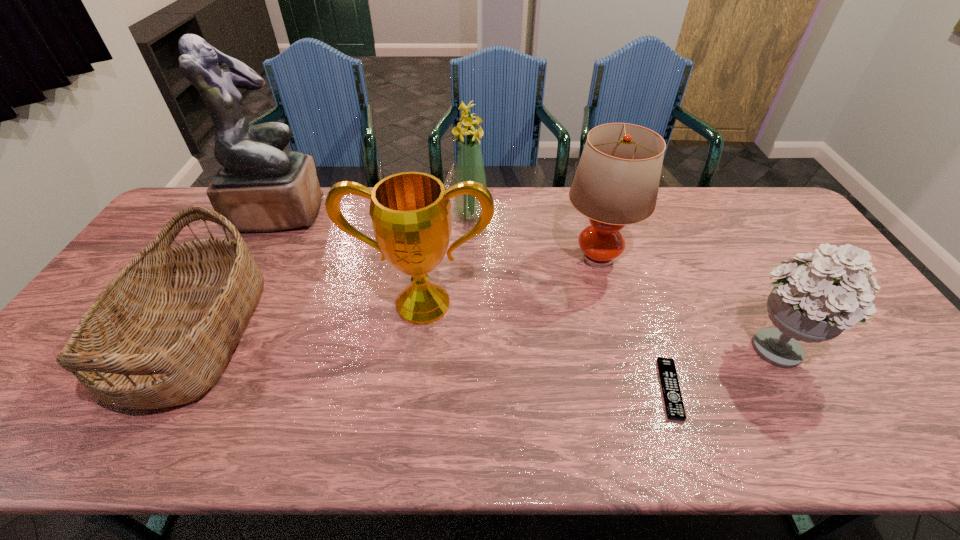
At what (x,y) coordinates should I click in order to perform the action: click on blank space located 0.300m on the front of the lamp. Please return your answer as a coordinate pair (x, y). Image resolution: width=960 pixels, height=540 pixels. Looking at the image, I should click on (630, 375).

Image resolution: width=960 pixels, height=540 pixels. Find the location of `free space located on the front-facing side of the left bouquet`. free space located on the front-facing side of the left bouquet is located at coordinates (599, 216).

At what (x,y) coordinates should I click in order to perform the action: click on free location located on the front-facing side of the award. Please return your answer as a coordinate pair (x, y). Image resolution: width=960 pixels, height=540 pixels. Looking at the image, I should click on (409, 423).

Find the location of a particular element. The image size is (960, 540). free point located 0.180m on the left of the nearer bouquet is located at coordinates (664, 346).

Where is `free space located 0.220m on the back of the sixth tallest object`? The width and height of the screenshot is (960, 540). free space located 0.220m on the back of the sixth tallest object is located at coordinates (257, 224).

Where is `vacant space located on the back of the shortest object`? This screenshot has width=960, height=540. vacant space located on the back of the shortest object is located at coordinates (625, 259).

The image size is (960, 540). Find the location of `sculpture that is at the far edge`. sculpture that is at the far edge is located at coordinates (259, 188).

I want to click on bouquet at the far edge, so click(469, 165).

The width and height of the screenshot is (960, 540). What are the coordinates of `basket located at the near edge` in the screenshot? It's located at (160, 334).

In order to click on remote control at the near edge in this screenshot , I will do `click(673, 400)`.